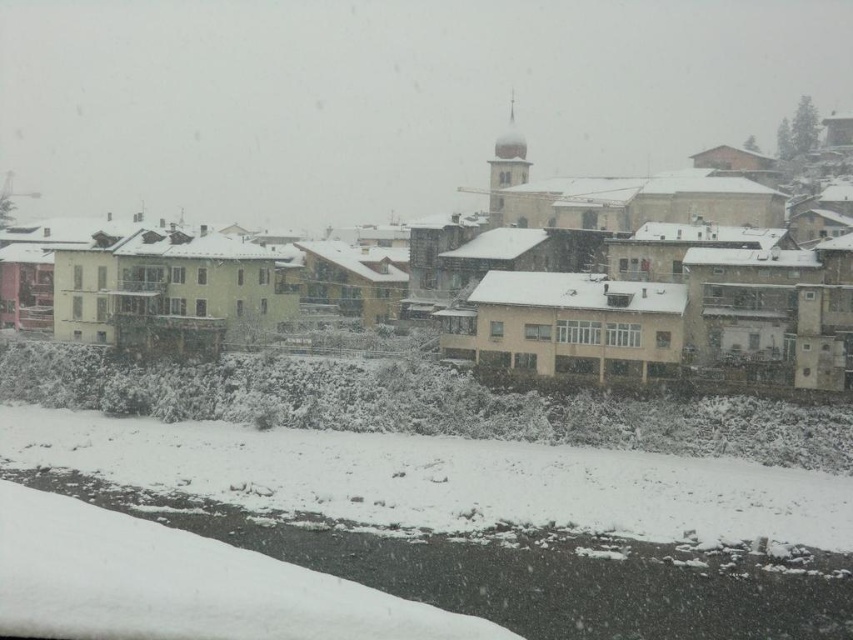
You are standing in the winter scene and want to walk towards the matte yellow building at center. Which direction should you move relative to the white fluffy snow at lower center?

You should move to the right of the white fluffy snow at lower center to head toward the matte yellow building at center since the snow is to the left of the building.

You are standing in the winter scene and want to take a photo of the matte yellow building at center without the white fluffy snow at lower center blocking the view. Is this possible?

The white fluffy snow at lower center is closer to the viewer than the matte yellow building at center, so it will block the view of the matte yellow building at center. Therefore, it is not possible to take a photo without the snow blocking the building.